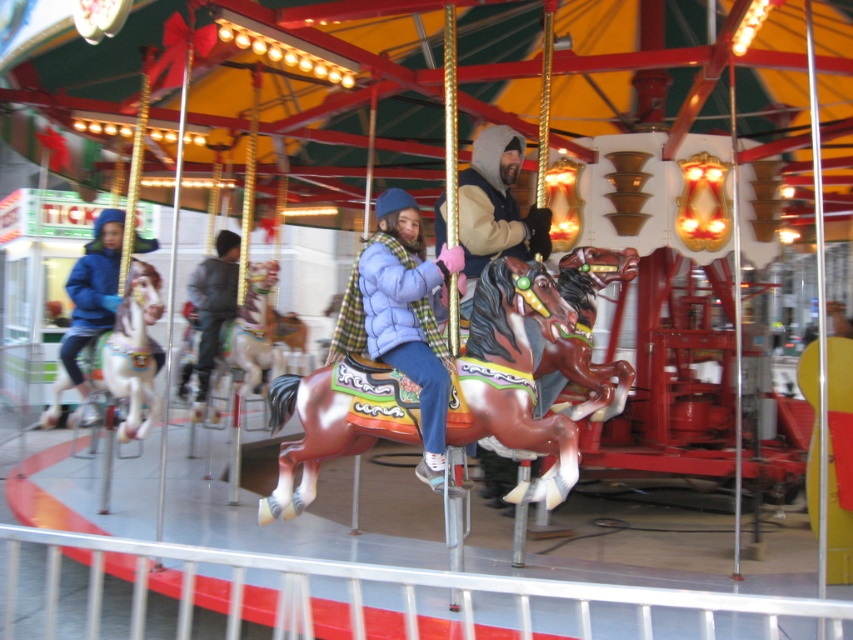
Question: Can you confirm if painted wood horse at center is positioned above white glossy horse at left?

Choices:
 (A) yes
 (B) no

Answer: (B)

Question: Can you confirm if painted wood horse at center is positioned to the right of white glossy horse at left?

Choices:
 (A) no
 (B) yes

Answer: (B)

Question: Estimate the real-world distances between objects in this image. Which object is farther from the matte blue jacket at center?

Choices:
 (A) white glossy horse at left
 (B) painted wood horse at center
 (C) gray fabric jacket at center

Answer: (C)

Question: Which point is closer to the camera?

Choices:
 (A) matte blue jacket at center
 (B) painted wood horse at center
 (C) gray fabric jacket at center

Answer: (B)

Question: Considering the relative positions of painted wood horse at center and gray fabric jacket at center in the image provided, where is painted wood horse at center located with respect to gray fabric jacket at center?

Choices:
 (A) right
 (B) left

Answer: (A)

Question: Based on their relative distances, which object is nearer to the matte blue jacket at center?

Choices:
 (A) gray fabric jacket at center
 (B) white glossy horse at left
 (C) matte brown horse at center
 (D) painted wood horse at center

Answer: (D)